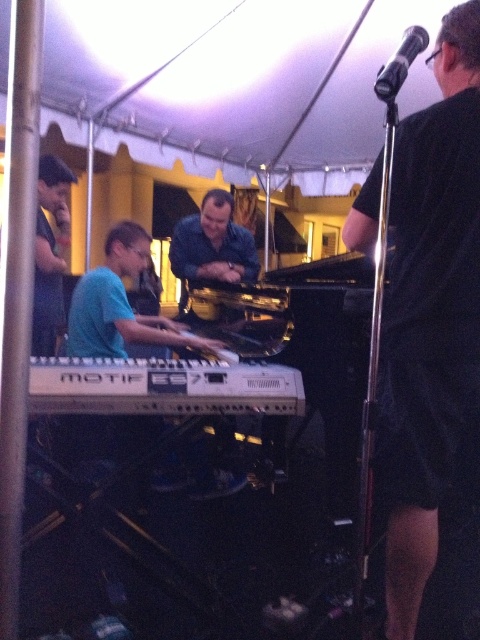
Can you confirm if white plastic keyboard at lower center is thinner than black metallic microphone at upper right?

Incorrect, white plastic keyboard at lower center's width is not less than black metallic microphone at upper right's.

Can you confirm if white plastic keyboard at lower center is taller than black metallic microphone at upper right?

In fact, white plastic keyboard at lower center may be shorter than black metallic microphone at upper right.

From the picture: Who is more forward, (80, 410) or (382, 84)?

Point (382, 84)

Where is `white plastic keyboard at lower center`? white plastic keyboard at lower center is located at coordinates (162, 387).

Is teal matte keyboard at center taller than black metallic microphone at upper right?

Indeed, teal matte keyboard at center has a greater height compared to black metallic microphone at upper right.

Can you confirm if teal matte keyboard at center is thinner than black metallic microphone at upper right?

No, teal matte keyboard at center is not thinner than black metallic microphone at upper right.

Identify the location of teal matte keyboard at center. This screenshot has height=640, width=480. (120, 305).

Who is more distant from viewer, (447, 422) or (83, 324)?

The point (83, 324) is more distant.

Measure the distance between black matte shirt at right and camera.

They are 5.03 feet apart.

Identify the location of black matte shirt at right. The image size is (480, 640). (431, 317).